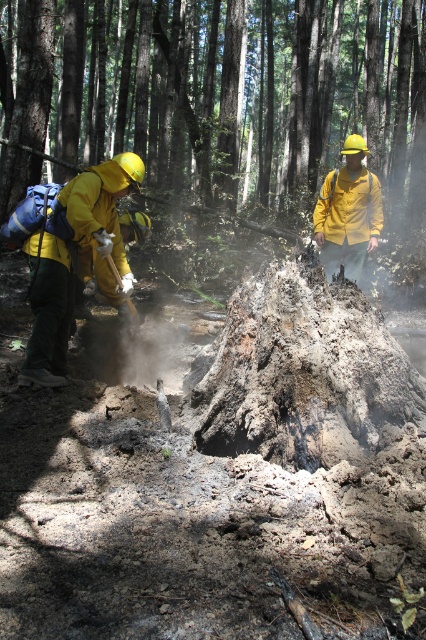
Does matte yellow jacket at left appear on the left side of matte yellow helmet at center?

Yes, matte yellow jacket at left is to the left of matte yellow helmet at center.

Does matte yellow jacket at left have a greater width compared to matte yellow helmet at center?

Indeed, matte yellow jacket at left has a greater width compared to matte yellow helmet at center.

Where is `matte yellow jacket at left`? This screenshot has width=426, height=640. matte yellow jacket at left is located at coordinates (101, 220).

Can you confirm if charcoal ash stump at center is smaller than matte yellow helmet at center?

No, charcoal ash stump at center is not smaller than matte yellow helmet at center.

Describe the element at coordinates (224, 96) in the screenshot. I see `charcoal ash stump at center` at that location.

The height and width of the screenshot is (640, 426). I want to click on charcoal ash stump at center, so click(224, 96).

Is charcoal ash stump at center below matte yellow jacket at left?

No, charcoal ash stump at center is not below matte yellow jacket at left.

Does charcoal ash stump at center have a greater width compared to matte yellow jacket at left?

Yes.

Where is `charcoal ash stump at center`? The image size is (426, 640). charcoal ash stump at center is located at coordinates (224, 96).